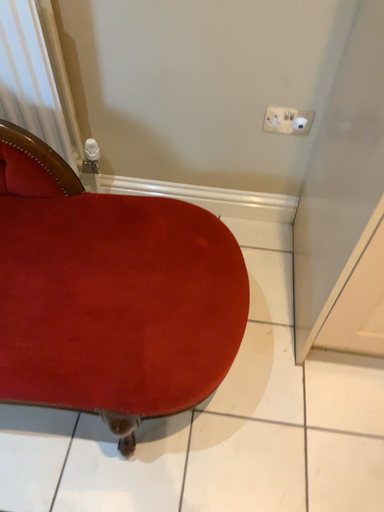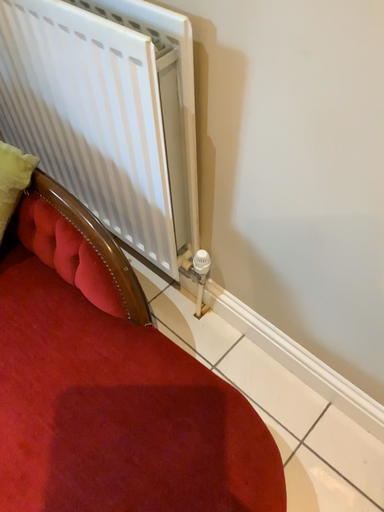
Question: Which way did the camera rotate in the video?

Choices:
 (A) rotated left
 (B) rotated right

Answer: (A)